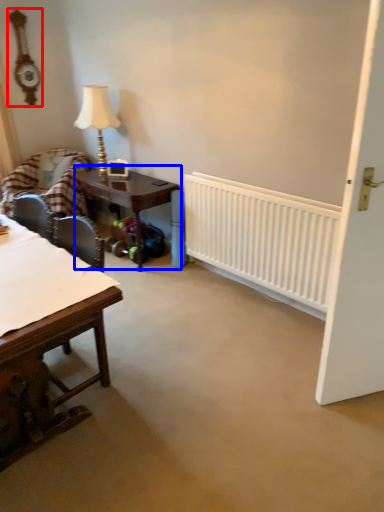
Question: Which object is closer to the camera taking this photo, clock (highlighted by a red box) or table (highlighted by a blue box)?

Choices:
 (A) clock
 (B) table

Answer: (B)